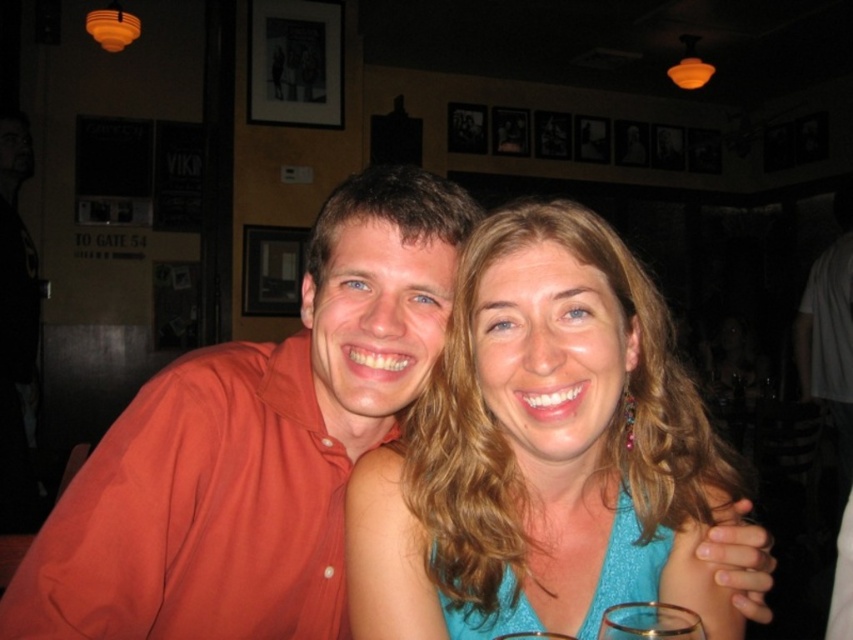
You are standing in a dimly lit indoor area with two points marked in the scene. The first point is at coordinates point (x=376, y=269) and the second is at point (x=618, y=628). Which point is closer to you?

Point (x=376, y=269) is closer to you because it is further to the viewer than point (x=618, y=628).

You are a photographer standing at the camera position. You want to place a small sticker exactly at the point marked by the coordinates point (363, 602). The sticker has a diameter of 1.5 inches. Will the sticker fit without overlapping any objects in the scene?

The point (363, 602) is 29.40 inches away from the camera. Since the sticker has a diameter of 1.5 inches, there is sufficient space for it to fit without overlapping any objects in the scene.

You are a photographer trying to capture a candid shot of the two people in the scene. You want to ensure that both the orange cotton shirt at center and the transparent glass at lower center are in focus. Given that your camera can only focus on objects within a 15 inch range, will you be able to achieve this?

The orange cotton shirt at center and transparent glass at lower center are 17.63 inches apart, which exceeds the camera focus range of 15 inches. Therefore, you cannot have both in focus simultaneously.